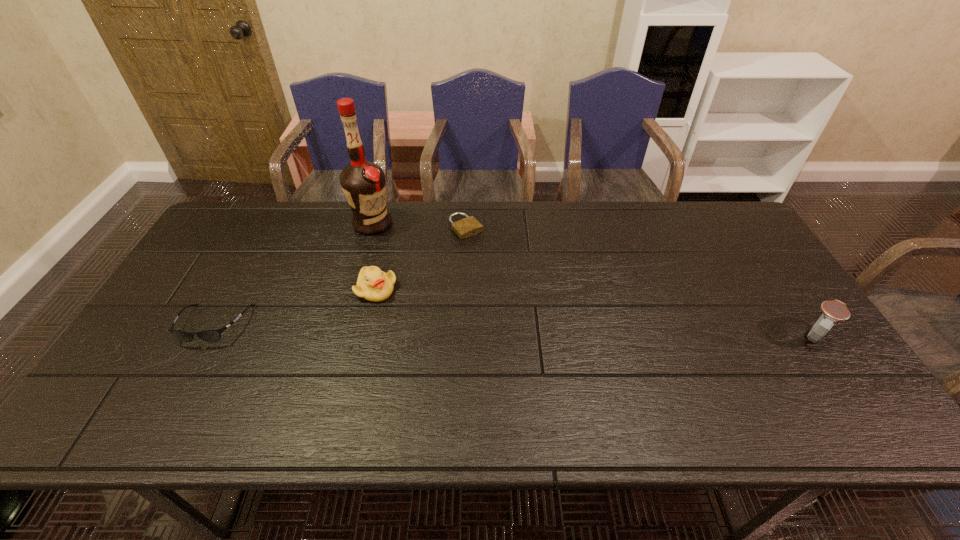
Identify which object is located as the fourth nearest to the fourth shortest object. Please provide its 2D coordinates. Your answer should be formatted as a tuple, i.e. [(x, y)], where the tuple contains the x and y coordinates of a point satisfying the conditions above.

[(213, 335)]

This screenshot has height=540, width=960. What are the coordinates of `free space that satisfies the following two spatial constraints: 1. on the front-facing side of the leftmost object; 2. on the left side of the watch` in the screenshot? It's located at (208, 336).

The image size is (960, 540). In order to click on free region that satisfies the following two spatial constraints: 1. on the front-facing side of the leftmost object; 2. on the right side of the fourth shortest object in this screenshot , I will do `click(208, 336)`.

The width and height of the screenshot is (960, 540). Find the location of `free space that satisfies the following two spatial constraints: 1. on the front side of the padlock; 2. on the right side of the fourth shortest object`. free space that satisfies the following two spatial constraints: 1. on the front side of the padlock; 2. on the right side of the fourth shortest object is located at coordinates point(462,336).

Locate an element on the screen. vacant point that satisfies the following two spatial constraints: 1. on the front-facing side of the fourth shortest object; 2. on the right side of the fourth tallest object is located at coordinates (208, 336).